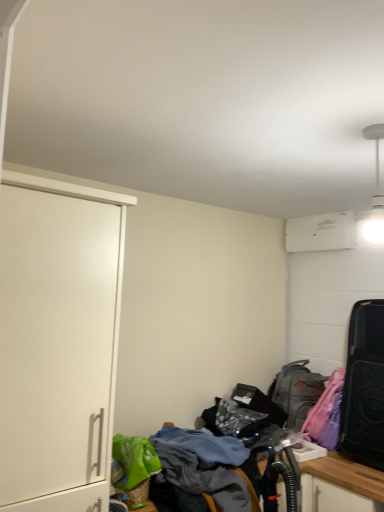
Question: From the image's perspective, is textured fabric desk at lower center above black matte suitcase at right?

Choices:
 (A) no
 (B) yes

Answer: (A)

Question: Are textured fabric desk at lower center and black matte suitcase at right far apart?

Choices:
 (A) no
 (B) yes

Answer: (A)

Question: From a real-world perspective, is textured fabric desk at lower center under black matte suitcase at right?

Choices:
 (A) no
 (B) yes

Answer: (B)

Question: Is textured fabric desk at lower center further to the viewer compared to black matte suitcase at right?

Choices:
 (A) no
 (B) yes

Answer: (A)

Question: Does textured fabric desk at lower center have a smaller size compared to black matte suitcase at right?

Choices:
 (A) yes
 (B) no

Answer: (B)

Question: Would you say black matte suitcase at right is part of textured fabric desk at lower center's contents?

Choices:
 (A) yes
 (B) no

Answer: (B)

Question: Is textured fabric desk at lower center at the right side of gray fabric backpack at lower right?

Choices:
 (A) yes
 (B) no

Answer: (B)

Question: From the image's perspective, would you say textured fabric desk at lower center is shown under gray fabric backpack at lower right?

Choices:
 (A) yes
 (B) no

Answer: (A)

Question: Considering the relative sizes of textured fabric desk at lower center and gray fabric backpack at lower right in the image provided, is textured fabric desk at lower center bigger than gray fabric backpack at lower right?

Choices:
 (A) yes
 (B) no

Answer: (A)

Question: Is gray fabric backpack at lower right inside textured fabric desk at lower center?

Choices:
 (A) no
 (B) yes

Answer: (A)

Question: Does textured fabric desk at lower center lie in front of gray fabric backpack at lower right?

Choices:
 (A) yes
 (B) no

Answer: (A)

Question: Is the depth of textured fabric desk at lower center greater than that of gray fabric backpack at lower right?

Choices:
 (A) no
 (B) yes

Answer: (A)

Question: From a real-world perspective, is white matte cabinet at left positioned over textured fabric desk at lower center based on gravity?

Choices:
 (A) yes
 (B) no

Answer: (A)